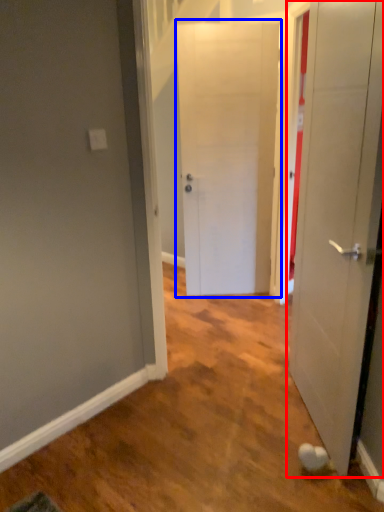
Question: Which point is further to the camera, door (highlighted by a red box) or door (highlighted by a blue box)?

Choices:
 (A) door
 (B) door

Answer: (B)